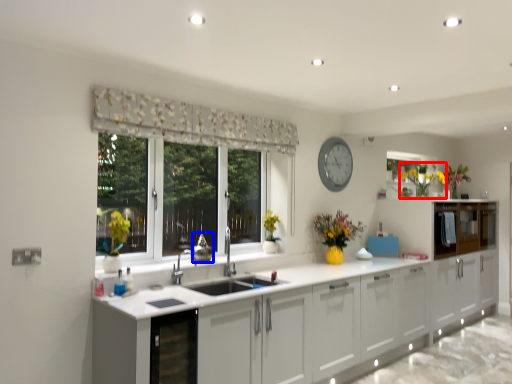
Question: Which point is further to the camera, floral arrangement (highlighted by a red box) or appliance (highlighted by a blue box)?

Choices:
 (A) floral arrangement
 (B) appliance

Answer: (A)